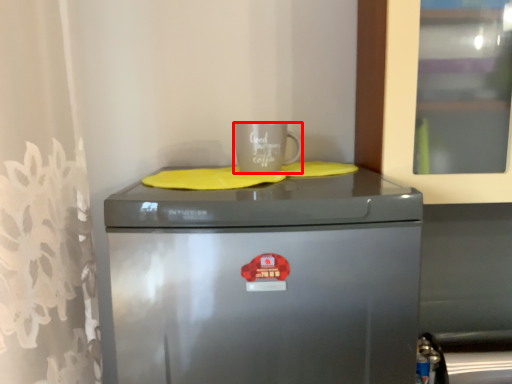
Question: From the image, what is the correct spatial relationship of mug (annotated by the red box) in relation to home appliance?

Choices:
 (A) left
 (B) right

Answer: (B)